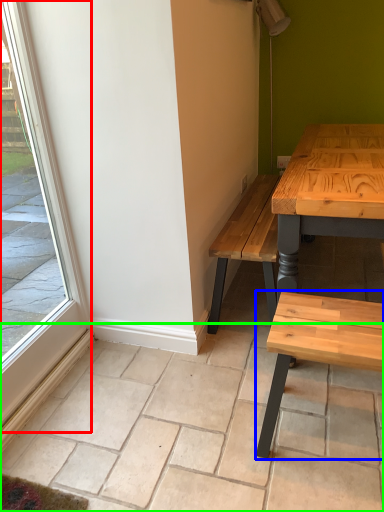
Question: Estimate the real-world distances between objects in this image. Which object is farther from window (highlighted by a red box), coffee table (highlighted by a blue box) or tile (highlighted by a green box)?

Choices:
 (A) coffee table
 (B) tile

Answer: (A)